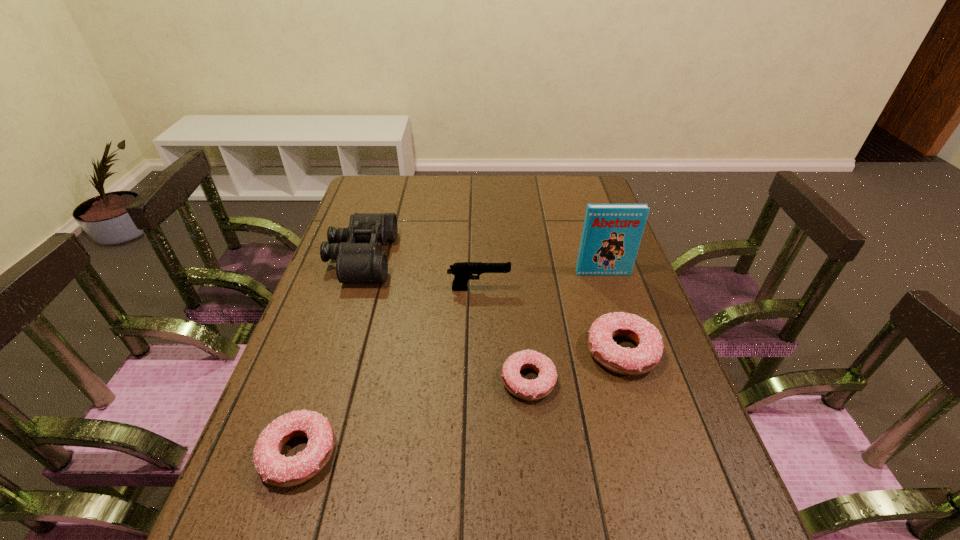
Find the location of `blank area in the image that satisfies the following two spatial constraints: 1. at the eyepieces of the shortest object; 2. on the left side of the binoculars`. blank area in the image that satisfies the following two spatial constraints: 1. at the eyepieces of the shortest object; 2. on the left side of the binoculars is located at coordinates (322, 381).

You are a GUI agent. You are given a task and a screenshot of the screen. Output one action in this format:
    pyautogui.click(x=<x>, y=<y>)
    Task: Click on the vacant point that satisfies the following two spatial constraints: 1. on the front-facing side of the pistol; 2. on the front side of the leftmost doughnut
    This screenshot has height=540, width=960.
    Given the screenshot: What is the action you would take?
    pyautogui.click(x=478, y=454)

Where is `vacant space that satisfies the following two spatial constraints: 1. at the eyepieces of the binoculars; 2. on the left side of the rightmost doughnut`? The height and width of the screenshot is (540, 960). vacant space that satisfies the following two spatial constraints: 1. at the eyepieces of the binoculars; 2. on the left side of the rightmost doughnut is located at coordinates (331, 352).

You are a GUI agent. You are given a task and a screenshot of the screen. Output one action in this format:
    pyautogui.click(x=<x>, y=<y>)
    Task: Click on the vacant space that satisfies the following two spatial constraints: 1. on the front-facing side of the fourth shortest object; 2. on the back side of the rightmost doughnut
    The height and width of the screenshot is (540, 960).
    Given the screenshot: What is the action you would take?
    pyautogui.click(x=479, y=352)

You are a GUI agent. You are given a task and a screenshot of the screen. Output one action in this format:
    pyautogui.click(x=<x>, y=<y>)
    Task: Click on the free space that satisfies the following two spatial constraints: 1. at the eyepieces of the binoculars; 2. on the back side of the rightmost doughnut
    
    Given the screenshot: What is the action you would take?
    pyautogui.click(x=331, y=352)